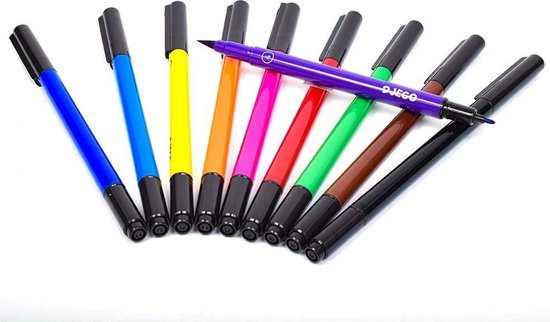
You are a GUI agent. You are given a task and a screenshot of the screen. Output one action in this format:
    pyautogui.click(x=<x>, y=<y>)
    Task: Click on the pen caps
    Image resolution: width=550 pixels, height=322 pixels.
    Given the screenshot: What is the action you would take?
    pyautogui.click(x=517, y=83), pyautogui.click(x=456, y=63), pyautogui.click(x=401, y=55), pyautogui.click(x=345, y=25), pyautogui.click(x=292, y=8), pyautogui.click(x=246, y=14), pyautogui.click(x=173, y=15), pyautogui.click(x=123, y=28), pyautogui.click(x=32, y=50)